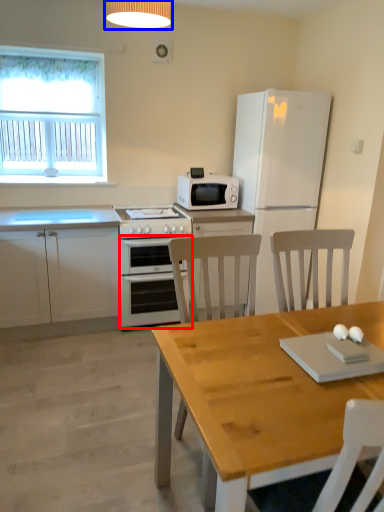
Question: Among these objects, which one is nearest to the camera, oven (highlighted by a red box) or lamp (highlighted by a blue box)?

Choices:
 (A) oven
 (B) lamp

Answer: (B)